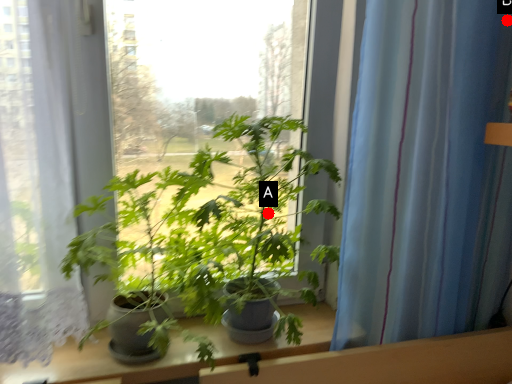
Question: Two points are circled on the image, labeled by A and B beside each circle. Which of the following is the closest to the observer?

Choices:
 (A) A is closer
 (B) B is closer

Answer: (B)